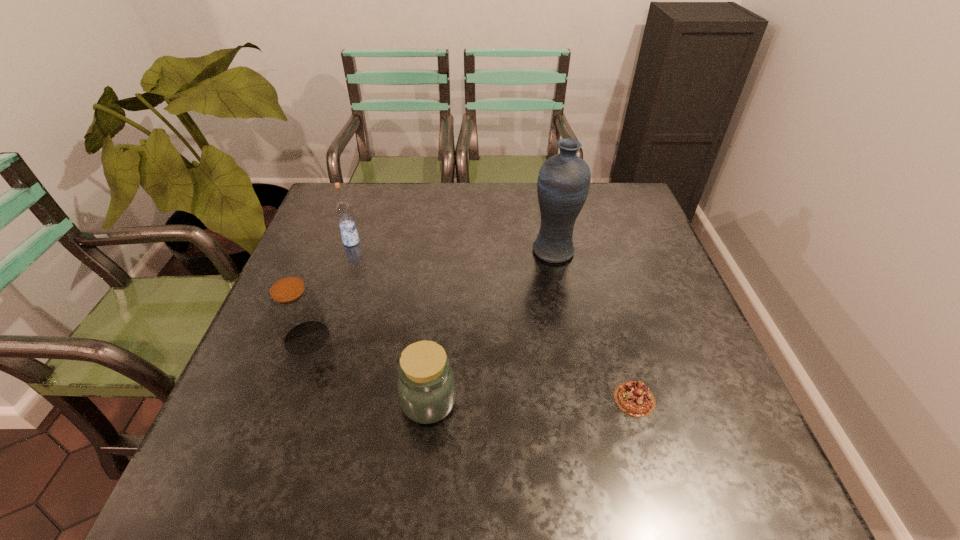
Find the location of a particular element. Image resolution: width=960 pixels, height=540 pixels. blank region between the third nearest object and the nearer jar is located at coordinates (368, 369).

Locate an element on the screen. This screenshot has height=540, width=960. empty location between the third nearest object and the nearer jar is located at coordinates (368, 369).

This screenshot has height=540, width=960. What are the coordinates of `free space that is in between the left jar and the right jar` in the screenshot? It's located at (368, 369).

Where is `free spot between the shortest object and the tallest object`? The image size is (960, 540). free spot between the shortest object and the tallest object is located at coordinates (594, 325).

You are a GUI agent. You are given a task and a screenshot of the screen. Output one action in this format:
    pyautogui.click(x=<x>, y=<y>)
    Task: Click on the free space that is in between the third nearest object and the vase
    The height and width of the screenshot is (540, 960).
    Given the screenshot: What is the action you would take?
    pyautogui.click(x=430, y=294)

Identify the location of empty location between the shortest object and the second tallest object. (492, 320).

You are a GUI agent. You are given a task and a screenshot of the screen. Output one action in this format:
    pyautogui.click(x=<x>, y=<y>)
    Task: Click on the unoccupied area between the nearer jar and the chocolate cake
    The width and height of the screenshot is (960, 540).
    Given the screenshot: What is the action you would take?
    pyautogui.click(x=532, y=400)

You are a GUI agent. You are given a task and a screenshot of the screen. Output one action in this format:
    pyautogui.click(x=<x>, y=<y>)
    Task: Click on the vacant area that lies between the second tallest object and the farther jar
    This screenshot has width=960, height=540.
    Given the screenshot: What is the action you would take?
    pyautogui.click(x=329, y=290)

The height and width of the screenshot is (540, 960). What are the coordinates of `vacant space that is in between the right jar and the vodka` in the screenshot? It's located at (390, 322).

This screenshot has width=960, height=540. In order to click on free space that is in between the vodka and the chocolate cake in this screenshot , I will do `click(492, 320)`.